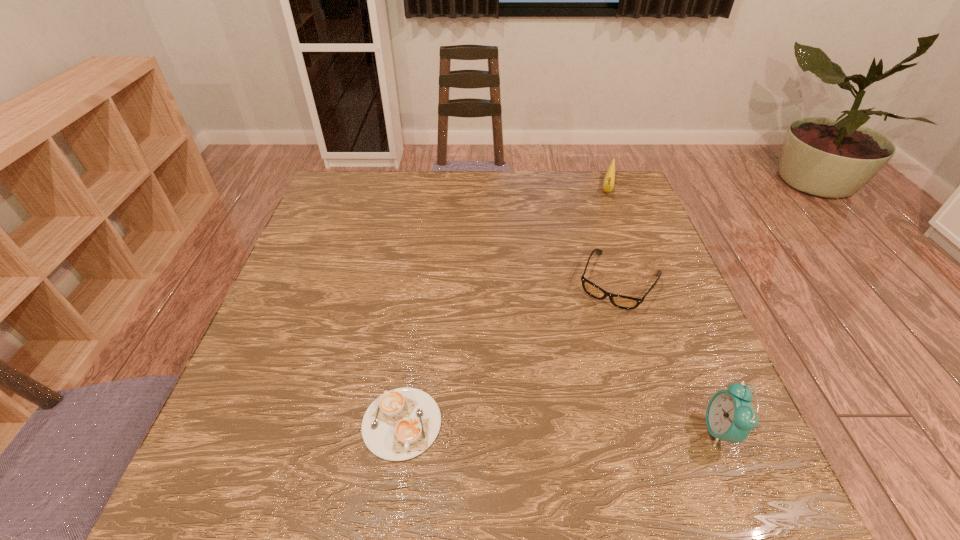
Find the location of a particular element. alarm clock that is at the right edge is located at coordinates click(x=730, y=417).

You are a GUI agent. You are given a task and a screenshot of the screen. Output one action in this format:
    pyautogui.click(x=<x>, y=<y>)
    Task: Click on the spectacles that is at the right edge
    
    Given the screenshot: What is the action you would take?
    pyautogui.click(x=623, y=302)

Where is `banana located in the right edge section of the desktop`? banana located in the right edge section of the desktop is located at coordinates (609, 180).

Where is `object that is positioned at the far right corner`? This screenshot has width=960, height=540. object that is positioned at the far right corner is located at coordinates (609, 180).

This screenshot has width=960, height=540. I want to click on object that is at the near right corner, so click(x=730, y=417).

In the image, there is a desktop. Where is `vacant space at the far edge`? This screenshot has height=540, width=960. vacant space at the far edge is located at coordinates (396, 195).

The width and height of the screenshot is (960, 540). I want to click on free space at the near edge of the desktop, so click(552, 424).

Locate an element on the screen. The height and width of the screenshot is (540, 960). vacant space at the left edge of the desktop is located at coordinates (275, 349).

I want to click on free region at the right edge of the desktop, so click(x=609, y=260).

Image resolution: width=960 pixels, height=540 pixels. Identify the location of free spot at the far left corner of the desktop. (350, 202).